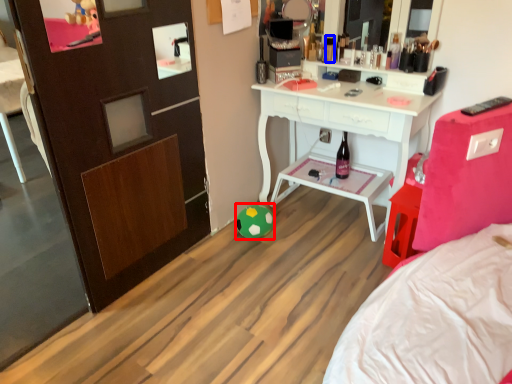
Question: Which object is further to the camera taking this photo, toy (highlighted by a red box) or toiletry (highlighted by a blue box)?

Choices:
 (A) toy
 (B) toiletry

Answer: (B)